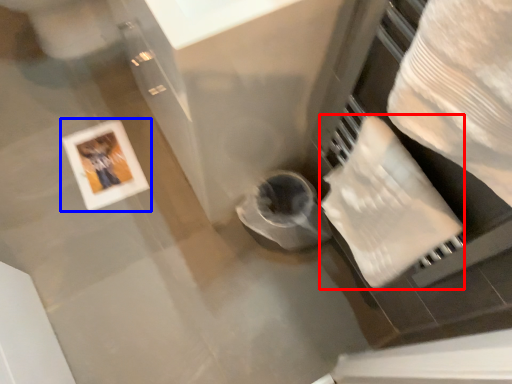
Question: Which object appears closest to the camera in this image, toilet paper (highlighted by a red box) or picture frame (highlighted by a blue box)?

Choices:
 (A) toilet paper
 (B) picture frame

Answer: (A)